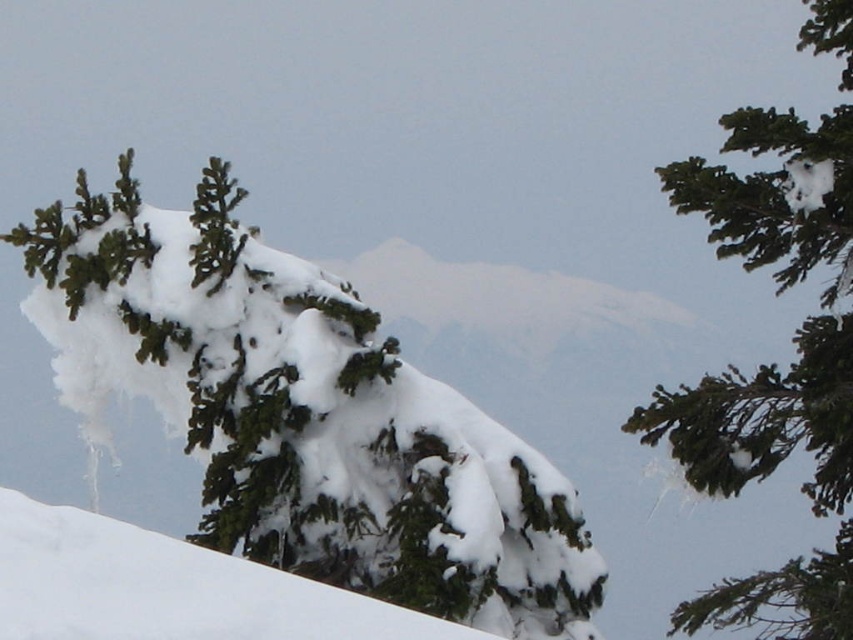
Between green matte evergreen tree at upper center and green matte tree branch at upper right, which one is positioned higher?

green matte tree branch at upper right is above.

This screenshot has height=640, width=853. Find the location of `green matte evergreen tree at upper center`. green matte evergreen tree at upper center is located at coordinates (303, 413).

Between point (325, 352) and point (399, 634), which one is positioned behind?

Point (325, 352)

Does green matte evergreen tree at upper center have a smaller size compared to white snow at center?

Actually, green matte evergreen tree at upper center might be larger than white snow at center.

This screenshot has height=640, width=853. In order to click on green matte evergreen tree at upper center in this screenshot , I will do `click(303, 413)`.

Where is `green matte evergreen tree at upper center`? The height and width of the screenshot is (640, 853). green matte evergreen tree at upper center is located at coordinates (303, 413).

Who is shorter, green matte tree branch at upper right or white snow at center?

white snow at center

I want to click on green matte tree branch at upper right, so click(776, 292).

Measure the distance between green matte tree branch at upper right and camera.

They are 7.22 meters apart.

The width and height of the screenshot is (853, 640). Find the location of `green matte tree branch at upper right`. green matte tree branch at upper right is located at coordinates (776, 292).